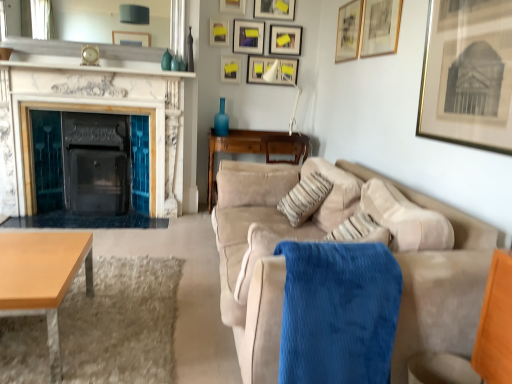
Question: From the image's perspective, is matte white picture frame at upper center, arranged as the fourth picture frame when viewed from the back, above or below blue glass vase at center, which ranks as the 1th vase in back-to-front order?

Choices:
 (A) below
 (B) above

Answer: (B)

Question: Based on their positions, is matte white picture frame at upper center, the seventh picture frame when ordered from front to back, located to the left or right of blue glass vase at center, placed as the 4th vase when sorted from front to back?

Choices:
 (A) left
 (B) right

Answer: (B)

Question: Which object is positioned farthest from the blue corduroy blanket at center?

Choices:
 (A) matte white picture frame at upper center, the 7th picture frame from the back
 (B) matte black picture frame at upper center, which is the 2th picture frame from back to front
 (C) white plastic lamp at upper center
 (D) light brown wooden coffee table at lower left
 (E) wooden table at lower left

Answer: (A)

Question: Which object is the closest to the shiny glass vase at upper center, marked as the 3th vase in a left-to-right arrangement?

Choices:
 (A) beige fabric pillow at center
 (B) white plastic lamp at upper center
 (C) matte white picture frame at upper center, which is counted as the 1th picture frame, starting from the back
 (D) beige suede couch at right
 (E) matte black picture frame at upper center, the eighth picture frame positioned from the front

Answer: (E)